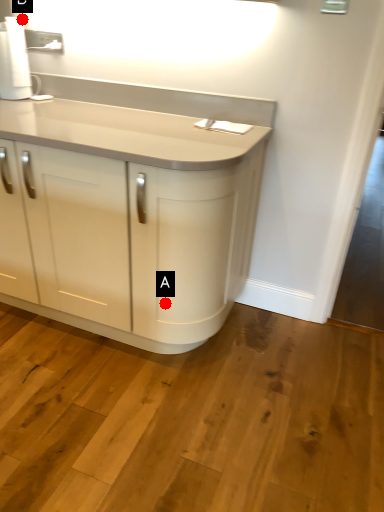
Question: Two points are circled on the image, labeled by A and B beside each circle. Among these points, which one is nearest to the camera?

Choices:
 (A) A is closer
 (B) B is closer

Answer: (A)